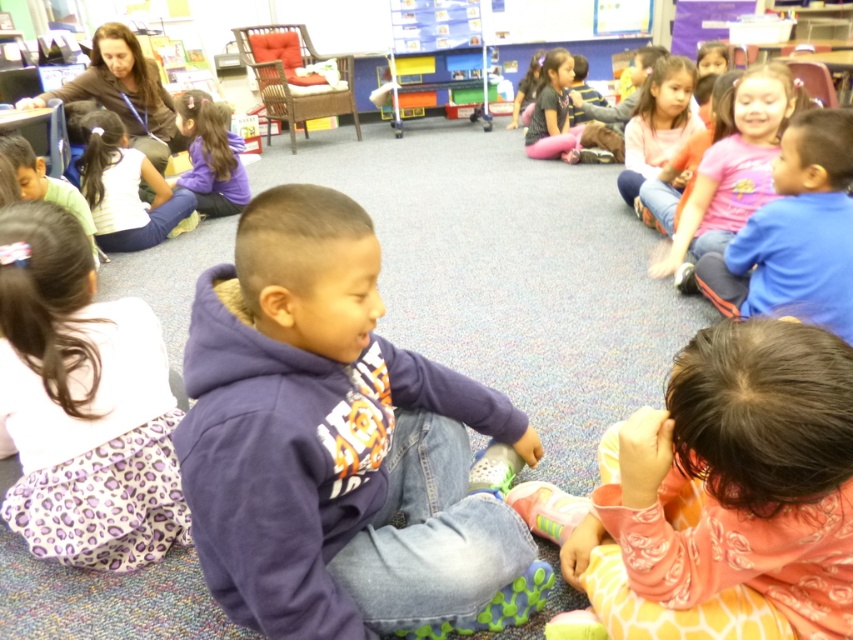
You are a teacher standing at the front of the classroom. You need to move a whiteboard from the back of the room to the front. The path between the matte purple shirt at center and the dark gray shirt at upper center is 7.70 feet. Can you move the whiteboard through this path without bending it?

The distance between the matte purple shirt at center and the dark gray shirt at upper center is 7.70 feet. If the whiteboard is shorter than or equal to this distance, it can be moved through the path without bending. However, if the whiteboard is longer than 7.70 feet, bending would be necessary.